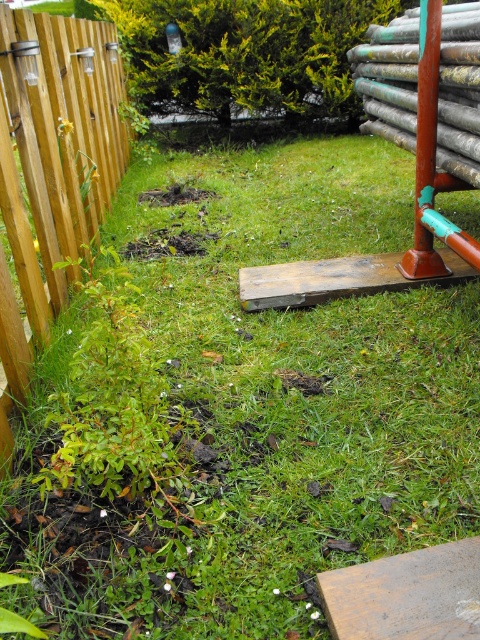
Locate an element on the screen. The height and width of the screenshot is (640, 480). wooden fence at left is located at coordinates (57, 147).

Who is shorter, wooden fence at left or rusty metal pole at right?

rusty metal pole at right is shorter.

The image size is (480, 640). What do you see at coordinates (57, 147) in the screenshot?
I see `wooden fence at left` at bounding box center [57, 147].

Locate an element on the screen. The image size is (480, 640). wooden fence at left is located at coordinates (57, 147).